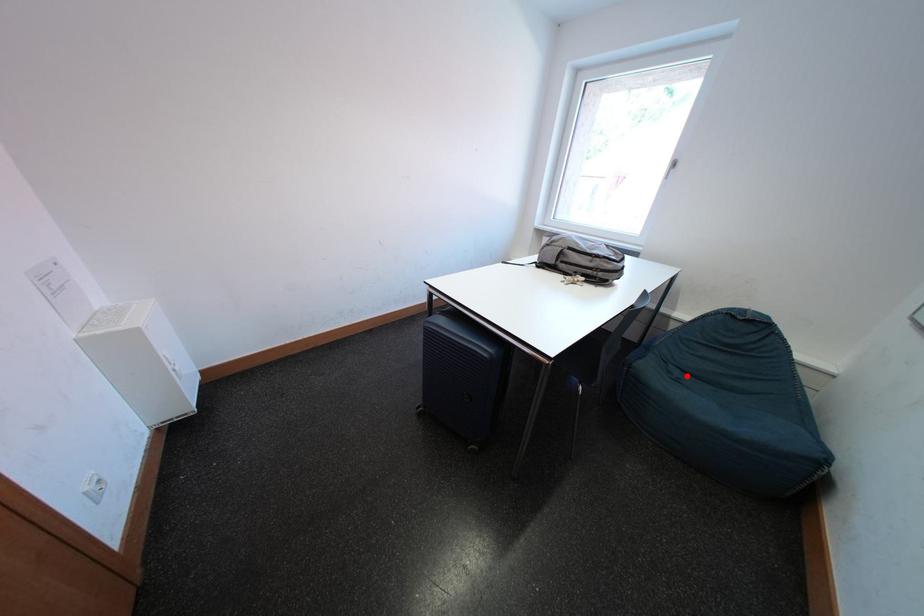
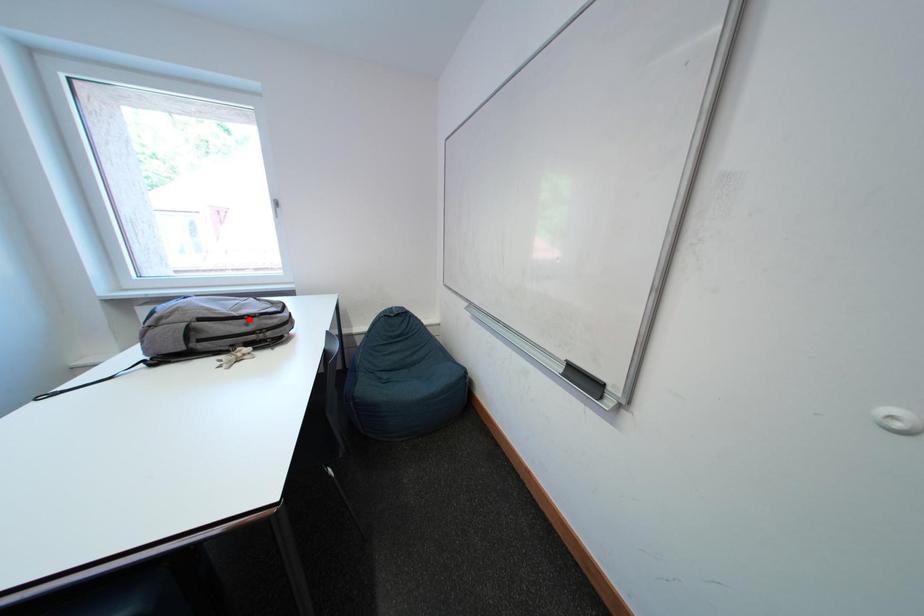
I am providing you with two images of the same scene from different viewpoints. A red point is marked on the first image and another point is marked on the second image. Are the points marked in image1 and image2 representing the same 3D position?

No